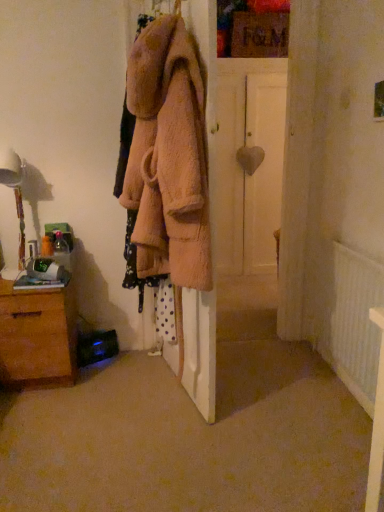
Question: From the image's perspective, is white matte door at center on top of white textured radiator at lower right?

Choices:
 (A) no
 (B) yes

Answer: (B)

Question: From a real-world perspective, is white matte door at center positioned under white textured radiator at lower right based on gravity?

Choices:
 (A) yes
 (B) no

Answer: (B)

Question: Is white matte door at center turned away from white textured radiator at lower right?

Choices:
 (A) yes
 (B) no

Answer: (B)

Question: Is the depth of white matte door at center greater than that of white textured radiator at lower right?

Choices:
 (A) no
 (B) yes

Answer: (B)

Question: Is white textured radiator at lower right located within white matte door at center?

Choices:
 (A) yes
 (B) no

Answer: (B)

Question: Considering the positions of brown wooden chest of drawers at lower left and white textured radiator at lower right in the image, is brown wooden chest of drawers at lower left taller or shorter than white textured radiator at lower right?

Choices:
 (A) short
 (B) tall

Answer: (A)

Question: Based on their sizes in the image, would you say brown wooden chest of drawers at lower left is bigger or smaller than white textured radiator at lower right?

Choices:
 (A) small
 (B) big

Answer: (B)

Question: From a real-world perspective, relative to white textured radiator at lower right, is brown wooden chest of drawers at lower left vertically above or below?

Choices:
 (A) below
 (B) above

Answer: (A)

Question: Does point (43, 340) appear closer or farther from the camera than point (367, 332)?

Choices:
 (A) closer
 (B) farther

Answer: (B)

Question: Does point (14, 161) appear closer or farther from the camera than point (221, 128)?

Choices:
 (A) closer
 (B) farther

Answer: (A)

Question: From a real-world perspective, relative to white matte door at center, is white glossy table lamp at left vertically above or below?

Choices:
 (A) below
 (B) above

Answer: (A)

Question: Looking at their shapes, would you say white glossy table lamp at left is wider or thinner than white matte door at center?

Choices:
 (A) thin
 (B) wide

Answer: (A)

Question: Is white glossy table lamp at left inside the boundaries of white matte door at center, or outside?

Choices:
 (A) inside
 (B) outside

Answer: (B)

Question: Considering the positions of soft pink fuzzy coat at center and white matte door at center in the image, is soft pink fuzzy coat at center bigger or smaller than white matte door at center?

Choices:
 (A) big
 (B) small

Answer: (B)

Question: Looking at their shapes, would you say soft pink fuzzy coat at center is wider or thinner than white matte door at center?

Choices:
 (A) wide
 (B) thin

Answer: (B)